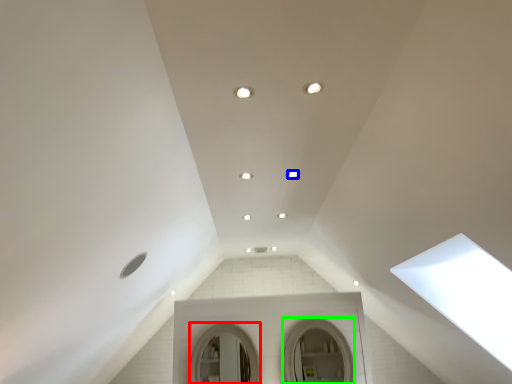
Question: Considering the real-world distances, which object is closest to mirror (highlighted by a red box)? lighting (highlighted by a blue box) or mirror (highlighted by a green box).

Choices:
 (A) lighting
 (B) mirror

Answer: (B)